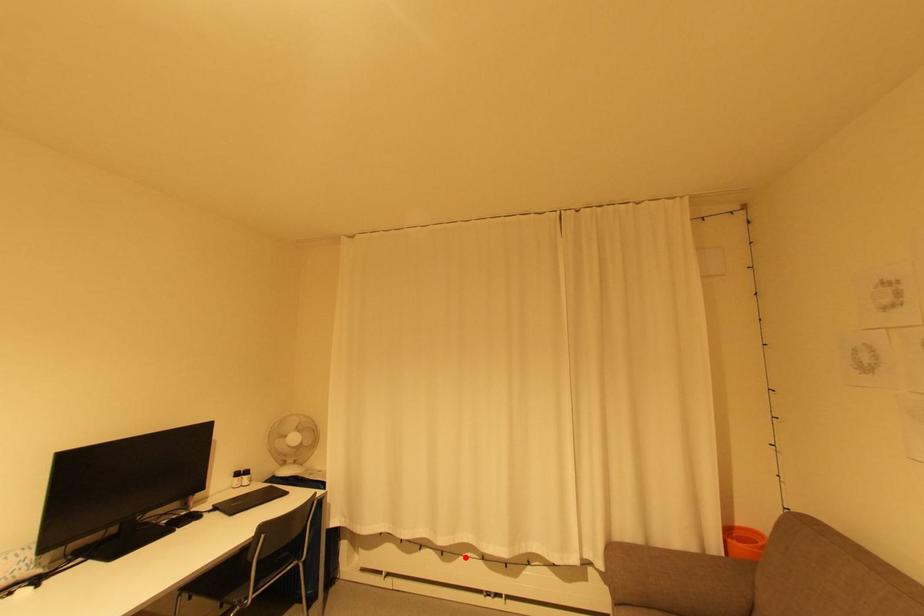
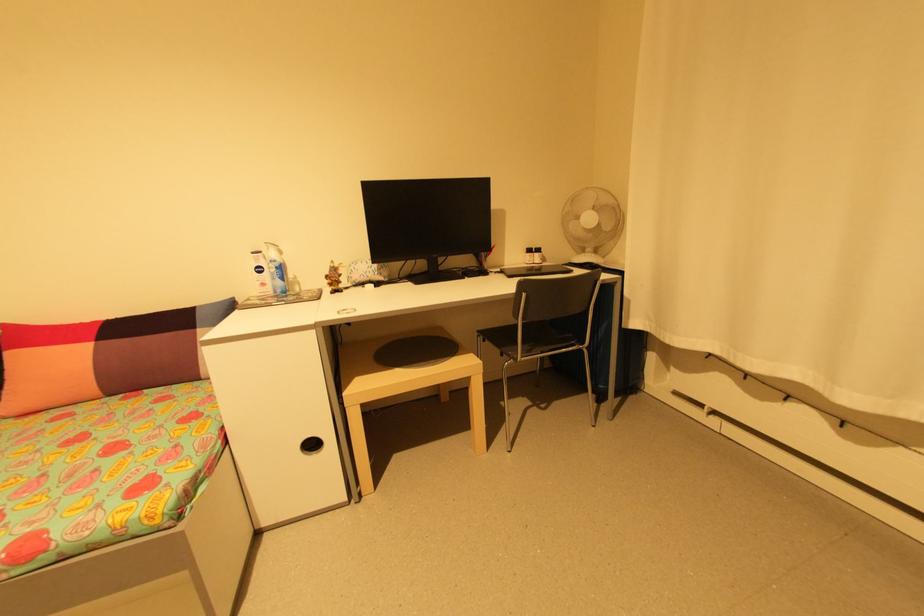
In the second image, find the point that corresponds to the highlighted location in the first image.

(906, 448)